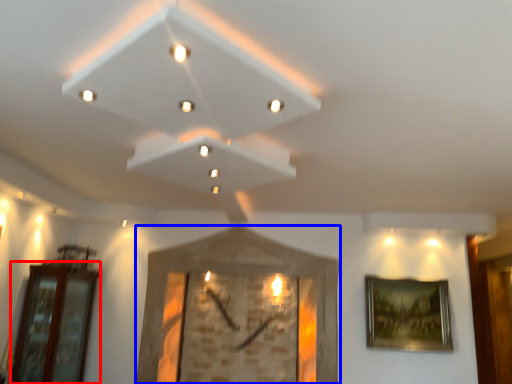
Question: Which object is closer to the camera taking this photo, glass door (highlighted by a red box) or picture frame (highlighted by a blue box)?

Choices:
 (A) glass door
 (B) picture frame

Answer: (A)